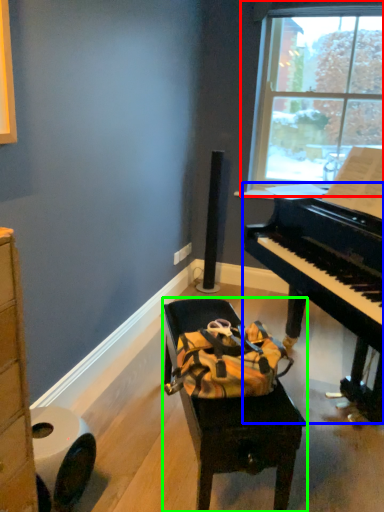
Question: Which object is the closest to the window (highlighted by a red box)? Choose among these: piano (highlighted by a blue box) or furniture (highlighted by a green box).

Choices:
 (A) piano
 (B) furniture

Answer: (A)